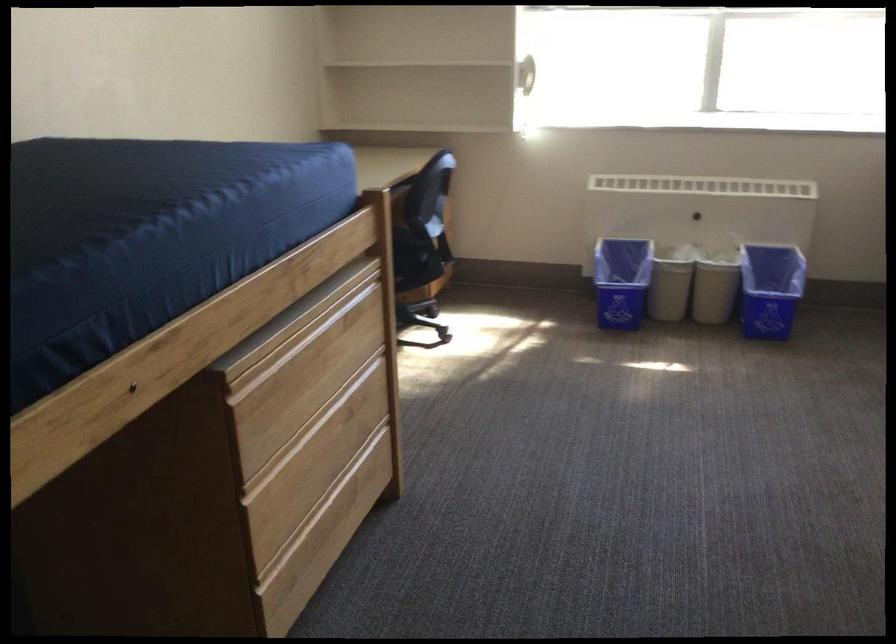
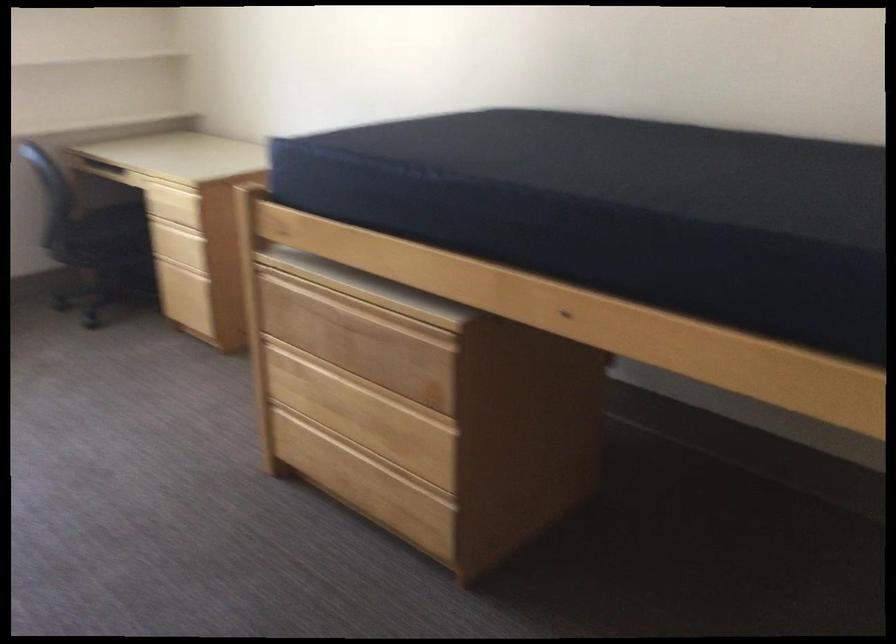
Question: The camera is either moving clockwise (left) or counter-clockwise (right) around the object. The first image is from the beginning of the video and the second image is from the end. Is the camera moving left or right when shooting the video?

Choices:
 (A) Left
 (B) Right

Answer: (A)